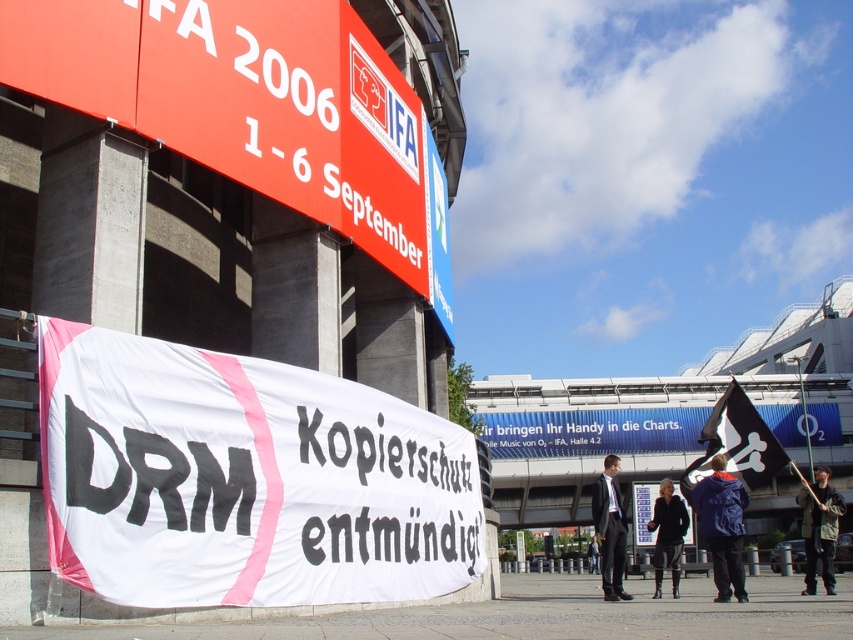
Question: Which point is closer to the camera?

Choices:
 (A) white fabric banner at upper center
 (B) camouflage jacket at right

Answer: (A)

Question: Can you confirm if dark gray suit at center is thinner than black leather jacket at center?

Choices:
 (A) yes
 (B) no

Answer: (A)

Question: Is white fabric banner at center smaller than white fabric banner at upper center?

Choices:
 (A) no
 (B) yes

Answer: (B)

Question: Among these objects, which one is nearest to the camera?

Choices:
 (A) blue fabric jacket at lower right
 (B) white fabric banner at upper center
 (C) black fabric flag at upper right
 (D) white fabric banner at center

Answer: (D)

Question: Is white fabric banner at center closer to the viewer compared to black fabric flag at upper right?

Choices:
 (A) yes
 (B) no

Answer: (A)

Question: Which of these objects is positioned farthest from the black fabric flag at upper right?

Choices:
 (A) white fabric banner at upper center
 (B) camouflage jacket at right

Answer: (A)